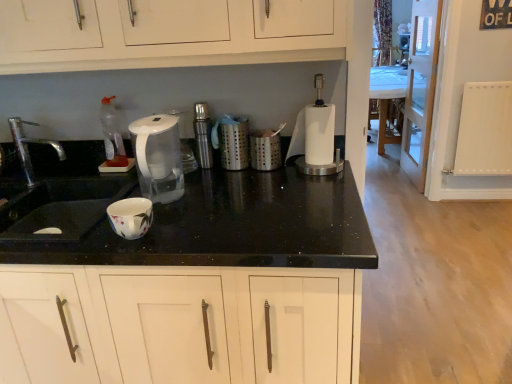
Question: Can we say transparent plastic kettle at center lies outside satin nickel faucet at center?

Choices:
 (A) yes
 (B) no

Answer: (A)

Question: Is transparent plastic kettle at center at the left side of satin nickel faucet at center?

Choices:
 (A) yes
 (B) no

Answer: (A)

Question: Considering the relative sizes of transparent plastic kettle at center and satin nickel faucet at center in the image provided, is transparent plastic kettle at center smaller than satin nickel faucet at center?

Choices:
 (A) no
 (B) yes

Answer: (A)

Question: From the image's perspective, is transparent plastic kettle at center over satin nickel faucet at center?

Choices:
 (A) no
 (B) yes

Answer: (A)

Question: Considering the relative positions of transparent plastic kettle at center and satin nickel faucet at center in the image provided, is transparent plastic kettle at center to the right of satin nickel faucet at center from the viewer's perspective?

Choices:
 (A) yes
 (B) no

Answer: (B)

Question: Is transparent plastic kettle at center placed right next to satin nickel faucet at center?

Choices:
 (A) no
 (B) yes

Answer: (A)

Question: Can you confirm if silver metallic faucet at left is thinner than satin nickel faucet at center?

Choices:
 (A) yes
 (B) no

Answer: (B)

Question: Considering the relative sizes of silver metallic faucet at left and satin nickel faucet at center in the image provided, is silver metallic faucet at left smaller than satin nickel faucet at center?

Choices:
 (A) no
 (B) yes

Answer: (A)

Question: Can you confirm if silver metallic faucet at left is wider than satin nickel faucet at center?

Choices:
 (A) no
 (B) yes

Answer: (B)

Question: Is silver metallic faucet at left shorter than satin nickel faucet at center?

Choices:
 (A) no
 (B) yes

Answer: (B)

Question: Does silver metallic faucet at left appear on the left side of satin nickel faucet at center?

Choices:
 (A) yes
 (B) no

Answer: (A)

Question: Could satin nickel faucet at center be considered to be inside silver metallic faucet at left?

Choices:
 (A) yes
 (B) no

Answer: (B)

Question: Is silver metallic faucet at left shorter than black granite countertop at center?

Choices:
 (A) no
 (B) yes

Answer: (B)